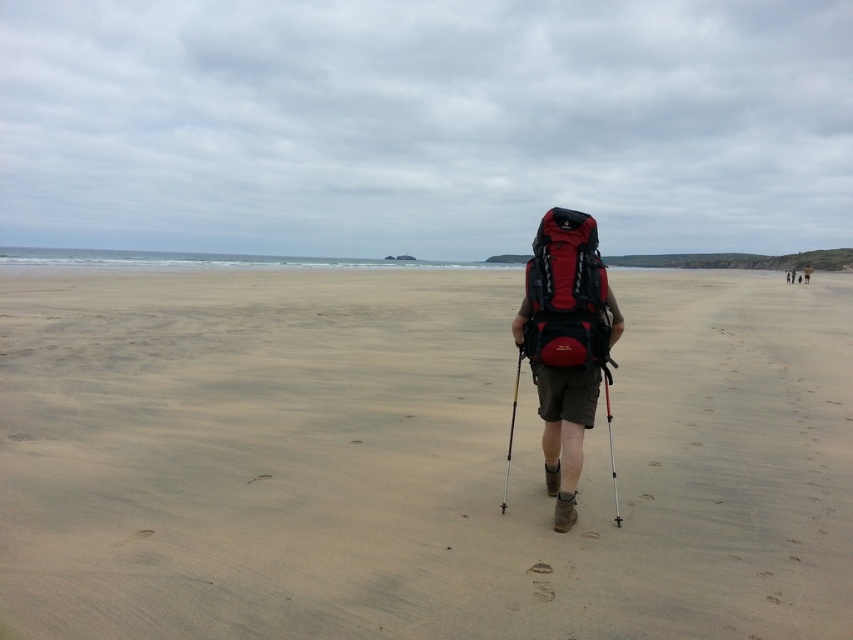
Which of these two, smooth sand at center or matte red backpack at center, stands shorter?

With less height is matte red backpack at center.

Who is taller, smooth sand at center or matte red backpack at center?

smooth sand at center is taller.

Between point (294, 484) and point (535, 298), which one is positioned in front?

Point (535, 298) is more forward.

You are a GUI agent. You are given a task and a screenshot of the screen. Output one action in this format:
    pyautogui.click(x=<x>, y=<y>)
    Task: Click on the smooth sand at center
    The height and width of the screenshot is (640, 853).
    Given the screenshot: What is the action you would take?
    pyautogui.click(x=415, y=460)

This screenshot has width=853, height=640. Describe the element at coordinates (415, 460) in the screenshot. I see `smooth sand at center` at that location.

Who is more forward, (444, 436) or (544, 272)?

Positioned in front is point (544, 272).

This screenshot has height=640, width=853. In order to click on smooth sand at center in this screenshot , I will do `click(415, 460)`.

Between smooth sand at center and matte black backpack at center, which one appears on the left side from the viewer's perspective?

smooth sand at center is more to the left.

How much distance is there between smooth sand at center and matte black backpack at center?

They are 138.86 feet apart.

Between point (434, 547) and point (809, 273), which one is positioned in front?

Positioned in front is point (434, 547).

Where is `smooth sand at center`? smooth sand at center is located at coordinates (415, 460).